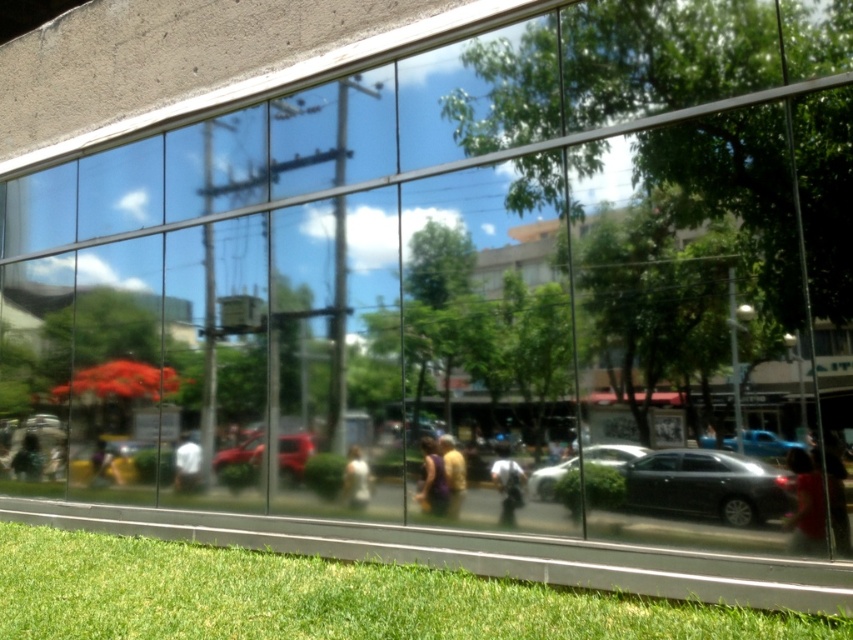
You are a delivery person carrying a package that is 1.5 meters long. You need to walk between the white glossy statue at center and the white matte shirt at center. Is there enough space for you to pass through with the package?

The distance between the white glossy statue at center and the white matte shirt at center is 1.27 meters. Since the package is 1.5 meters long, it is wider than the available space, so you cannot pass through with the package.

You are standing in front of the modern building and want to take a photo of both the matte black sedan at lower right and the white glossy car at center. Which car should you focus on first to ensure both are in clear view?

You should focus on the matte black sedan at lower right first because it is closer to you than the white glossy car at center, so adjusting focus from near to far will help capture both clearly.